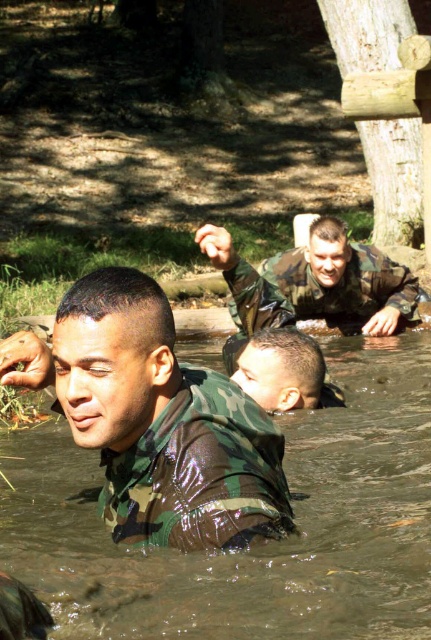
You are a photographer trying to capture a group photo of the camouflage uniform at upper center and the camo uniform head at center. Which one should you position to the left side of the photo to ensure both are framed properly?

You should position the camo uniform head at center to the left side of the photo because the camouflage uniform at upper center is already to the right of it.

You are a photographer trying to capture a clear shot of both the camouflage uniform at upper center and the camo uniform head at center. Since you want to ensure both are in focus, which object should you focus on first considering their sizes in the frame?

The camouflage uniform at upper center has a greater height compared to the camo uniform head at center, so you should focus on the camouflage uniform at upper center first as it is larger in the frame.

You are a soldier in a training exercise and need to retrieve a water bottle from the camouflage fabric man at center who is 1.74 meters away. Can you reach it without moving from your current position?

The camouflage fabric man at center is 1.74 meters away from you, so if your reach can extend to at least 1.74 meters, you can retrieve the water bottle without moving. Otherwise, you might need to step closer.